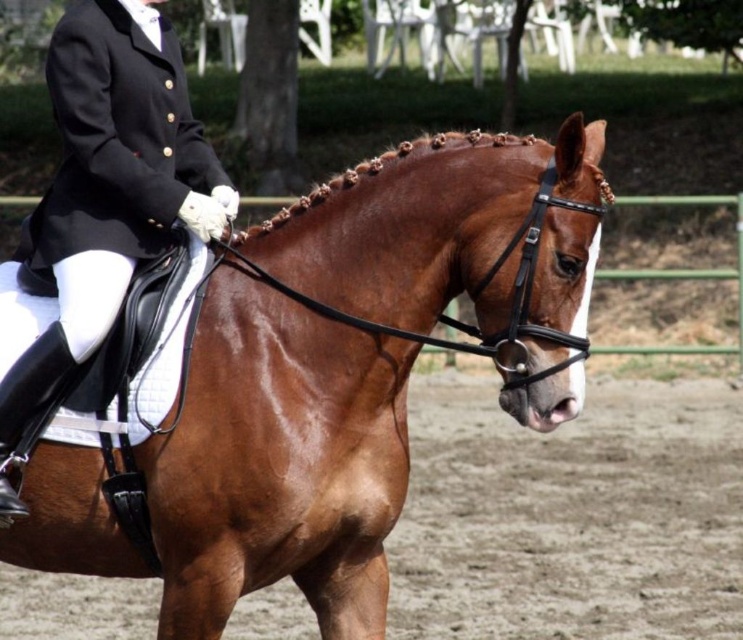
In the scene shown: You are a spectator at the equestrian event. You see the shiny brown horse at center and the black leather jacket at upper left. Which object is positioned lower in the image?

The shiny brown horse at center is positioned lower than the black leather jacket at upper left.

You are a photographer standing at the edge of the brown dirt field at center and want to take a picture of the black leather jacket at upper left. Which direction should you move to get the jacket in your frame?

The brown dirt field at center is located below the black leather jacket at upper left, so you should move towards the upper left direction to get the jacket in your frame.

You are a photographer at a horse show and want to capture the shiny brown horse at center and the brown dirt field at center in a single frame. Which object should you focus on first to ensure both are in the shot?

The shiny brown horse at center is larger in size than the brown dirt field at center, so you should focus on the shiny brown horse at center first to ensure both are in the shot.